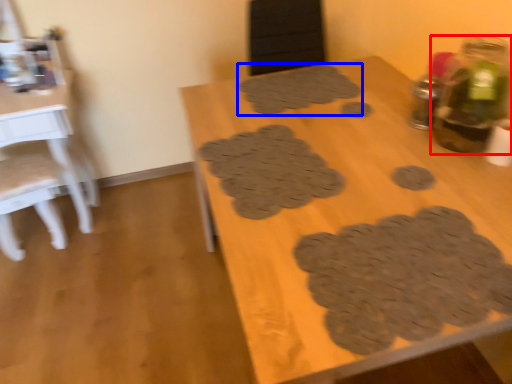
Question: Which point is closer to the camera, bottle (highlighted by a red box) or footprint (highlighted by a blue box)?

Choices:
 (A) bottle
 (B) footprint

Answer: (A)